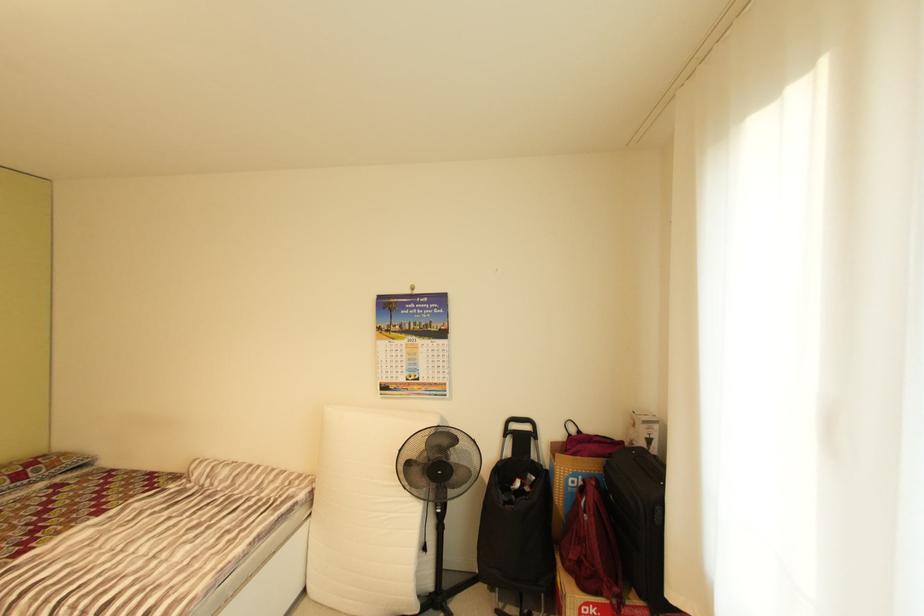
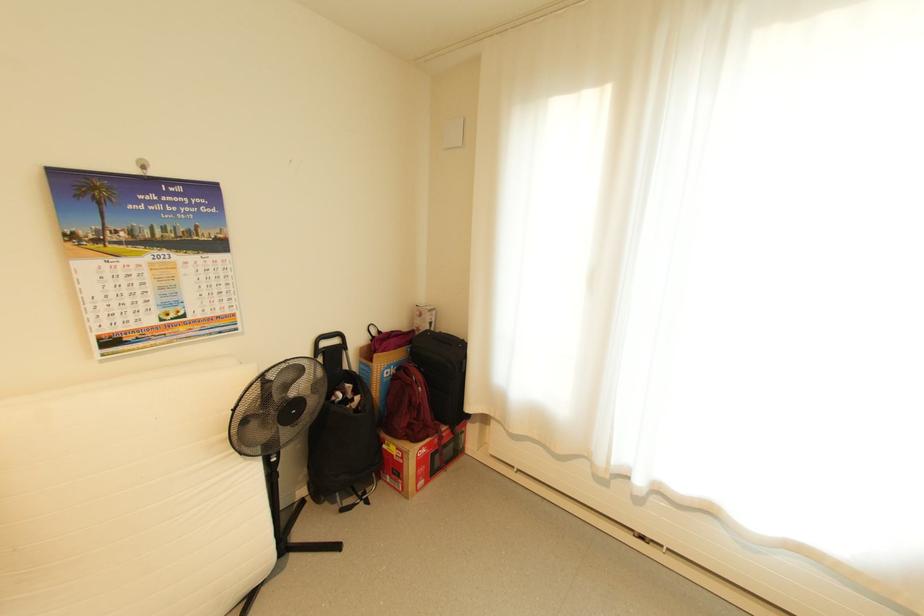
Question: How did the camera likely rotate?

Choices:
 (A) Left
 (B) Right
 (C) Up
 (D) Down

Answer: (B)